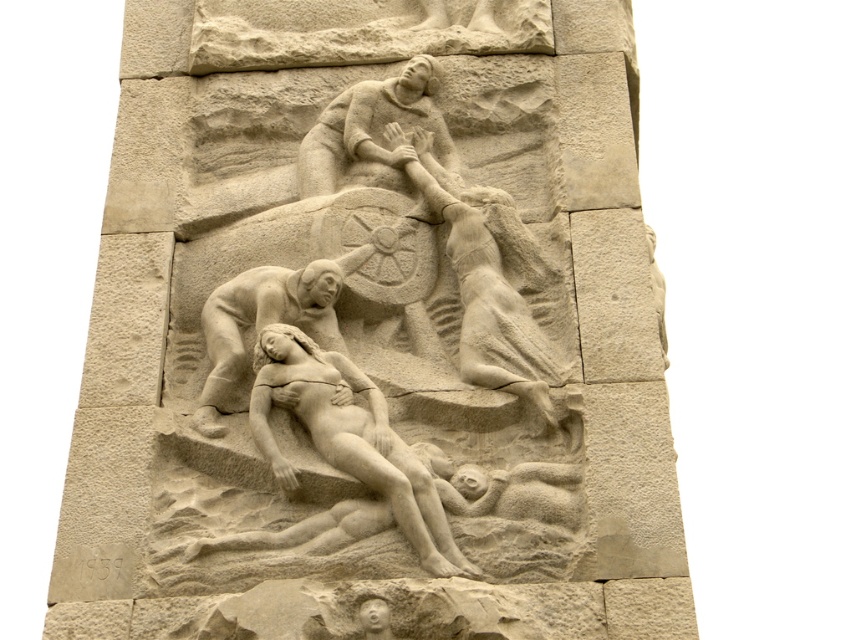
Based on the scene described, which object is wider between the smooth stone warrior at center and the smooth stone reclining figure at lower center?

The smooth stone reclining figure at lower center is wider than the smooth stone warrior at center.

Based on the coordinates provided in the description, where is the smooth stone warrior at center located in the relief sculpture?

The smooth stone warrior at center is located at point coordinates of 0.436 on the x axis and 0.571 on the y axis.